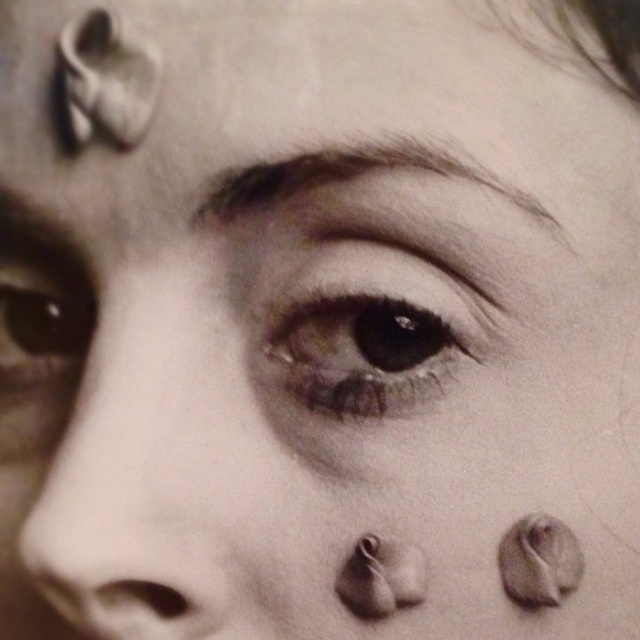
Is the position of smooth skin nose at center less distant than that of brown matte eye at center?

Yes, it is.

The width and height of the screenshot is (640, 640). Find the location of `smooth skin nose at center`. smooth skin nose at center is located at coordinates (118, 522).

Locate an element on the screen. This screenshot has width=640, height=640. smooth skin nose at center is located at coordinates (118, 522).

Locate an element on the screen. This screenshot has height=640, width=640. smooth skin nose at center is located at coordinates (118, 522).

Is the position of smooth skin nose at center more distant than that of dark brown eyebrow at upper center?

No, smooth skin nose at center is in front of dark brown eyebrow at upper center.

Between point (109, 497) and point (344, 161), which one is positioned in front?

Point (109, 497) is more forward.

Is point (96, 512) positioned behind point (413, 147)?

No, (96, 512) is in front of (413, 147).

The image size is (640, 640). In order to click on smooth skin nose at center in this screenshot , I will do `click(118, 522)`.

Which of these two, smooth skin nose at center or brown matte eye at left, stands shorter?

With less height is brown matte eye at left.

Does smooth skin nose at center have a greater height compared to brown matte eye at left?

Yes, smooth skin nose at center is taller than brown matte eye at left.

At what (x,y) coordinates should I click in order to perform the action: click on smooth skin nose at center. Please return your answer as a coordinate pair (x, y). This screenshot has height=640, width=640. Looking at the image, I should click on (118, 522).